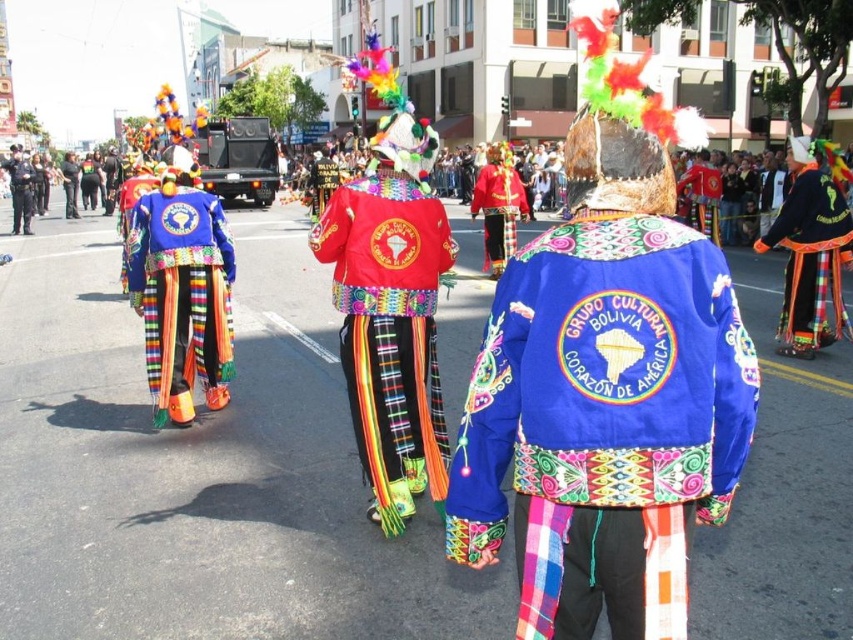
Who is positioned more to the right, matte blue fabric jacket at center or black uniform at left?

matte blue fabric jacket at center

Between matte blue fabric jacket at center and black uniform at left, which one is positioned higher?

Positioned higher is black uniform at left.

Is point (177, 276) farther from viewer compared to point (26, 225)?

No, it is in front of (26, 225).

You are a GUI agent. You are given a task and a screenshot of the screen. Output one action in this format:
    pyautogui.click(x=<x>, y=<y>)
    Task: Click on the matte blue fabric jacket at center
    This screenshot has width=853, height=640.
    Given the screenshot: What is the action you would take?
    pyautogui.click(x=183, y=296)

Looking at this image, can you confirm if red velvet jacket at center is shorter than velvet blue jacket at center?

No.

How far apart are red velvet jacket at center and velvet blue jacket at center?

red velvet jacket at center is 4.93 meters away from velvet blue jacket at center.

The width and height of the screenshot is (853, 640). In order to click on red velvet jacket at center in this screenshot , I will do `click(390, 332)`.

Does matte blue fabric jacket at center have a smaller size compared to velvet blue jacket at center?

Correct, matte blue fabric jacket at center occupies less space than velvet blue jacket at center.

Is matte blue fabric jacket at center further to the viewer compared to velvet blue jacket at center?

No, it is in front of velvet blue jacket at center.

Where is `matte blue fabric jacket at center`? The width and height of the screenshot is (853, 640). matte blue fabric jacket at center is located at coordinates point(183,296).